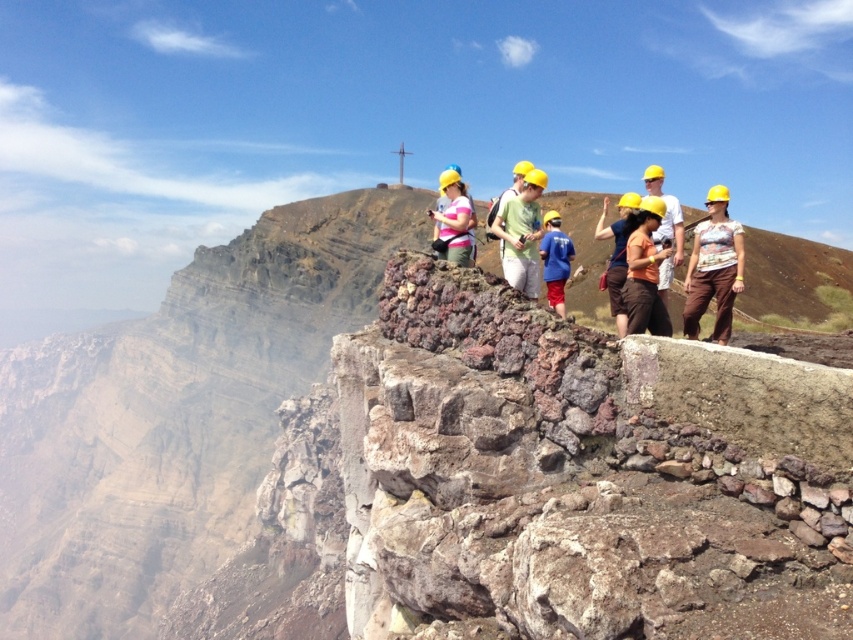
Consider the image. You are a hiker who wants to ensure your gear fits properly. You have a yellow hard hat at center and a blue fabric shirt at center. Which item would you need to adjust if you want both items to be the same size?

The yellow hard hat at center is larger in size than the blue fabric shirt at center, so you would need to adjust the yellow hard hat at center to reduce its size or the blue fabric shirt at center to increase its size to make them match.